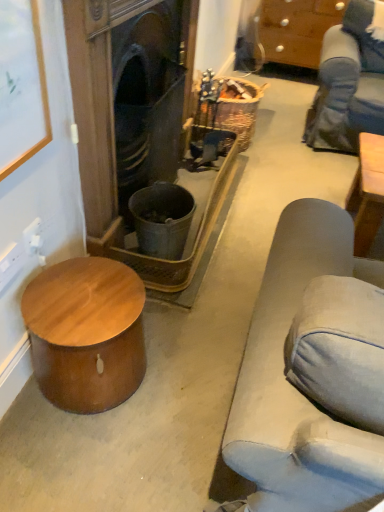
Where is `brown wood cabinet at upper right`? brown wood cabinet at upper right is located at coordinates (297, 29).

Describe the element at coordinates (96, 100) in the screenshot. I see `dark wood fireplace at center` at that location.

Image resolution: width=384 pixels, height=512 pixels. Describe the element at coordinates (86, 333) in the screenshot. I see `wooden drum at lower left` at that location.

Find the location of a particular element. The width and height of the screenshot is (384, 512). wooden drum at lower left is located at coordinates (86, 333).

I want to click on brown wood cabinet at upper right, so click(297, 29).

Which is more to the right, dark wood fireplace at center or wooden picture frame at upper left?

dark wood fireplace at center is more to the right.

Does dark wood fireplace at center come behind wooden picture frame at upper left?

Yes, dark wood fireplace at center is further from the camera.

What's the angular difference between dark wood fireplace at center and wooden picture frame at upper left's facing directions?

The angular difference between dark wood fireplace at center and wooden picture frame at upper left is 0.0141 degrees.

Which object is thinner, dark wood fireplace at center or wooden picture frame at upper left?

Thinner between the two is wooden picture frame at upper left.

Which object is further away from the camera taking this photo, wooden picture frame at upper left or wooden drum at lower left?

wooden drum at lower left is more distant.

Considering the relative sizes of wooden picture frame at upper left and wooden drum at lower left in the image provided, is wooden picture frame at upper left bigger than wooden drum at lower left?

Actually, wooden picture frame at upper left might be smaller than wooden drum at lower left.

Looking at their sizes, would you say wooden picture frame at upper left is wider or thinner than wooden drum at lower left?

In the image, wooden picture frame at upper left appears to be more narrow than wooden drum at lower left.

From a real-world perspective, between wooden drum at lower left and dark wood fireplace at center, who is vertically higher?

dark wood fireplace at center.

Is wooden drum at lower left bigger or smaller than dark wood fireplace at center?

wooden drum at lower left is smaller than dark wood fireplace at center.

Does wooden drum at lower left have a greater height compared to dark wood fireplace at center?

No, wooden drum at lower left is not taller than dark wood fireplace at center.

The image size is (384, 512). What are the coordinates of `desk in front of the dark wood fireplace at center` in the screenshot? It's located at (86, 333).

Consider the image. Considering the positions of objects wooden drum at lower left and brown wood cabinet at upper right in the image provided, who is more to the left, wooden drum at lower left or brown wood cabinet at upper right?

From the viewer's perspective, wooden drum at lower left appears more on the left side.

Is wooden drum at lower left far from brown wood cabinet at upper right?

Yes, wooden drum at lower left and brown wood cabinet at upper right are located far from each other.

Where is `desk located underneath the brown wood cabinet at upper right (from a real-world perspective)`? This screenshot has width=384, height=512. desk located underneath the brown wood cabinet at upper right (from a real-world perspective) is located at coordinates (86, 333).

Between wooden drum at lower left and brown wood cabinet at upper right, which one has more height?

brown wood cabinet at upper right is taller.

Who is shorter, brown wood cabinet at upper right or wooden drum at lower left?

Standing shorter between the two is wooden drum at lower left.

Identify the location of cabinetry on the right side of wooden drum at lower left. (297, 29).

In the scene shown: Is brown wood cabinet at upper right next to wooden drum at lower left?

brown wood cabinet at upper right and wooden drum at lower left are clearly separated.

Choose the correct answer: Is brown wood cabinet at upper right inside wooden drum at lower left or outside it?

brown wood cabinet at upper right is outside wooden drum at lower left.

You are a GUI agent. You are given a task and a screenshot of the screen. Output one action in this format:
    pyautogui.click(x=<x>, y=<y>)
    Task: Click on the cabinetry located behind the wooden picture frame at upper left
    The height and width of the screenshot is (512, 384).
    Given the screenshot: What is the action you would take?
    pyautogui.click(x=297, y=29)

Can you confirm if wooden picture frame at upper left is bigger than brown wood cabinet at upper right?

No.

Could you tell me if wooden picture frame at upper left is facing brown wood cabinet at upper right?

No, wooden picture frame at upper left is not facing towards brown wood cabinet at upper right.

Is point (26, 52) positioned in front of point (269, 48)?

That is True.

Between point (69, 329) and point (5, 110), which one is positioned in front?

The point (5, 110) is closer to the camera.

Consider the image. Is wooden drum at lower left far from wooden picture frame at upper left?

No.

The height and width of the screenshot is (512, 384). What are the coordinates of `desk that appears behind the wooden picture frame at upper left` in the screenshot? It's located at (86, 333).

From the image's perspective, is wooden drum at lower left over wooden picture frame at upper left?

No, from the image's perspective, wooden drum at lower left is not above wooden picture frame at upper left.

Locate an element on the screen. The width and height of the screenshot is (384, 512). fireplace above the wooden picture frame at upper left (from the image's perspective) is located at coordinates 96,100.

Locate an element on the screen. The image size is (384, 512). picture frame in front of the wooden drum at lower left is located at coordinates (21, 85).

When comparing their distances from wooden picture frame at upper left, does brown wood cabinet at upper right or wooden drum at lower left seem further?

brown wood cabinet at upper right is positioned further to the anchor wooden picture frame at upper left.

From the image, which object appears to be nearer to brown wood cabinet at upper right, dark wood fireplace at center or wooden picture frame at upper left?

Among the two, dark wood fireplace at center is located nearer to brown wood cabinet at upper right.

Which object lies further to the anchor point dark wood fireplace at center, brown wood cabinet at upper right or wooden drum at lower left?

The object further to dark wood fireplace at center is brown wood cabinet at upper right.

Which object lies further to the anchor point dark wood fireplace at center, wooden picture frame at upper left or wooden drum at lower left?

wooden drum at lower left is further to dark wood fireplace at center.

From the image, which object appears to be nearer to wooden drum at lower left, wooden picture frame at upper left or dark wood fireplace at center?

Based on the image, dark wood fireplace at center appears to be nearer to wooden drum at lower left.

Estimate the real-world distances between objects in this image. Which object is closer to wooden picture frame at upper left, wooden drum at lower left or brown wood cabinet at upper right?

wooden drum at lower left is positioned closer to the anchor wooden picture frame at upper left.

Estimate the real-world distances between objects in this image. Which object is closer to brown wood cabinet at upper right, wooden picture frame at upper left or dark wood fireplace at center?

dark wood fireplace at center is closer to brown wood cabinet at upper right.

Estimate the real-world distances between objects in this image. Which object is further from brown wood cabinet at upper right, dark wood fireplace at center or wooden drum at lower left?

The object further to brown wood cabinet at upper right is wooden drum at lower left.

Locate an element on the screen. desk located between wooden picture frame at upper left and brown wood cabinet at upper right in the depth direction is located at coordinates (86, 333).

Locate an element on the screen. The width and height of the screenshot is (384, 512). fireplace between wooden drum at lower left and brown wood cabinet at upper right from front to back is located at coordinates (96, 100).

Locate an element on the screen. The width and height of the screenshot is (384, 512). fireplace between wooden picture frame at upper left and brown wood cabinet at upper right from front to back is located at coordinates (96, 100).

Locate an element on the screen. This screenshot has height=512, width=384. picture frame that lies between dark wood fireplace at center and wooden drum at lower left from top to bottom is located at coordinates [21, 85].